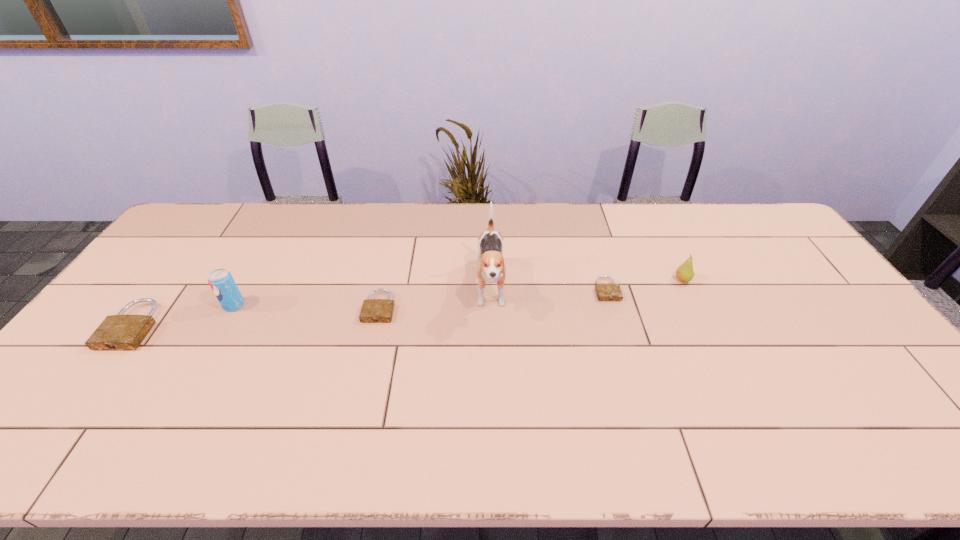
Where is `the third tallest object`? the third tallest object is located at coordinates tap(685, 273).

The width and height of the screenshot is (960, 540). Identify the location of the rightmost object. (685, 273).

The image size is (960, 540). In order to click on blank area located 0.140m on the keyhole side of the tallest padlock in this screenshot , I will do `click(79, 397)`.

At what (x,y) coordinates should I click in order to perform the action: click on blank space located on the keyhole side of the fourth object from right to left. Please return your answer as a coordinate pair (x, y). This screenshot has width=960, height=540. Looking at the image, I should click on (358, 402).

Locate an element on the screen. Image resolution: width=960 pixels, height=540 pixels. free space located 0.200m on the keyhole side of the shortest object is located at coordinates (627, 356).

You are a GUI agent. You are given a task and a screenshot of the screen. Output one action in this format:
    pyautogui.click(x=<x>, y=<y>)
    Task: Click on the free space located 0.160m at the face of the puppy
    Image resolution: width=960 pixels, height=540 pixels.
    Given the screenshot: What is the action you would take?
    pyautogui.click(x=492, y=372)

This screenshot has height=540, width=960. What are the coordinates of `vacant area situated 0.190m on the front of the soda can` in the screenshot? It's located at (199, 368).

Identify the location of vacant region located on the back of the third tallest object. The image size is (960, 540). (670, 253).

Where is `object that is at the left edge`? The height and width of the screenshot is (540, 960). object that is at the left edge is located at coordinates (119, 332).

Where is `free space at the far edge`? free space at the far edge is located at coordinates (245, 207).